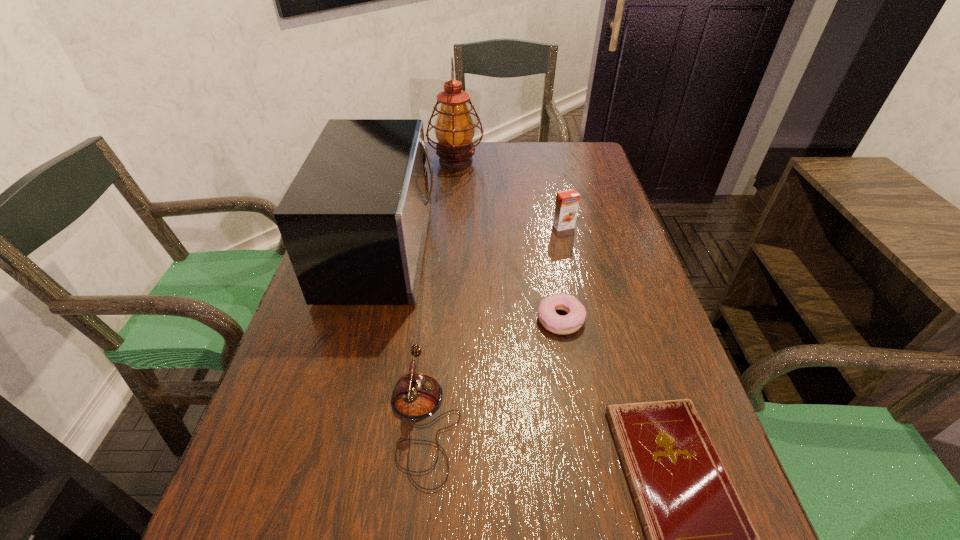
At what (x,y) coordinates should I click in order to perform the action: click on empty location between the second shortest object and the telephone. Please return your answer as a coordinate pair (x, y). This screenshot has height=540, width=960. Looking at the image, I should click on (492, 372).

At what (x,y) coordinates should I click in order to perform the action: click on free space between the fifth shortest object and the telephone. Please return your answer as a coordinate pair (x, y). This screenshot has width=960, height=540. Looking at the image, I should click on (403, 336).

Identify the location of free space between the second tallest object and the orange juice. The height and width of the screenshot is (540, 960). (473, 238).

The height and width of the screenshot is (540, 960). Find the location of `vacant area between the telephone and the fifth tallest object`. vacant area between the telephone and the fifth tallest object is located at coordinates (492, 372).

Where is `empty space that is in between the telephone and the fifth shortest object`? Image resolution: width=960 pixels, height=540 pixels. empty space that is in between the telephone and the fifth shortest object is located at coordinates (403, 336).

Find the location of a particular element. The height and width of the screenshot is (540, 960). free space between the microwave oven and the doughnut is located at coordinates (471, 284).

Find the location of `object that stands as the closest to the telephone`. object that stands as the closest to the telephone is located at coordinates (354, 220).

I want to click on object that is the fourth closest one to the fifth tallest object, so click(566, 207).

Find the location of a particular element. blank space that satisfies the following two spatial constraints: 1. on the front side of the oil lamp; 2. on the rotary dial of the telephone is located at coordinates (435, 424).

Where is `free space in the image that satisfies the following two spatial constraints: 1. on the front side of the fifth tallest object; 2. on the left side of the oil lamp`? free space in the image that satisfies the following two spatial constraints: 1. on the front side of the fifth tallest object; 2. on the left side of the oil lamp is located at coordinates (444, 319).